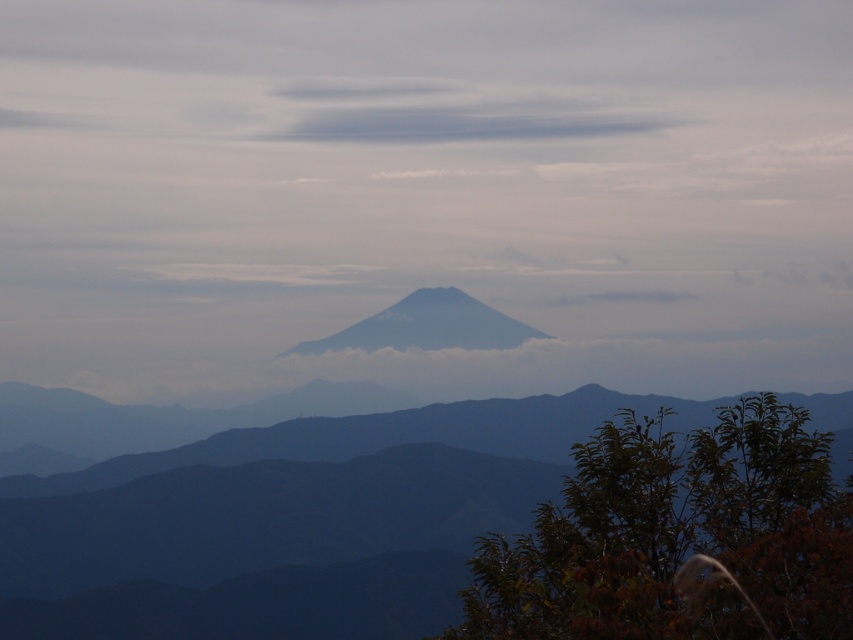
Who is more distant from viewer, (216, 572) or (393, 102)?

The point (393, 102) is more distant.

Is point (576, 541) in front of point (436, 81)?

Yes, point (576, 541) is closer to viewer.

Is point (704, 548) closer to camera compared to point (341, 84)?

Yes, it is in front of point (341, 84).

Image resolution: width=853 pixels, height=640 pixels. I want to click on dark blue mountain range at center, so click(432, 536).

Between dark blue mountain range at center and grayish-blue rock formation at center, which one appears on the right side from the viewer's perspective?

dark blue mountain range at center is more to the right.

Which is above, dark blue mountain range at center or grayish-blue rock formation at center?

grayish-blue rock formation at center is higher up.

Where is `dark blue mountain range at center`? The height and width of the screenshot is (640, 853). dark blue mountain range at center is located at coordinates (432, 536).

The image size is (853, 640). Find the location of `dark blue mountain range at center`. dark blue mountain range at center is located at coordinates (432, 536).

Can you confirm if gray/cloudy sky at upper center is positioned above grayish-blue rock formation at center?

Yes, gray/cloudy sky at upper center is above grayish-blue rock formation at center.

Does point (517, 106) come in front of point (401, 330)?

No, (517, 106) is behind (401, 330).

Find the location of a particular element. The width and height of the screenshot is (853, 640). gray/cloudy sky at upper center is located at coordinates (457, 113).